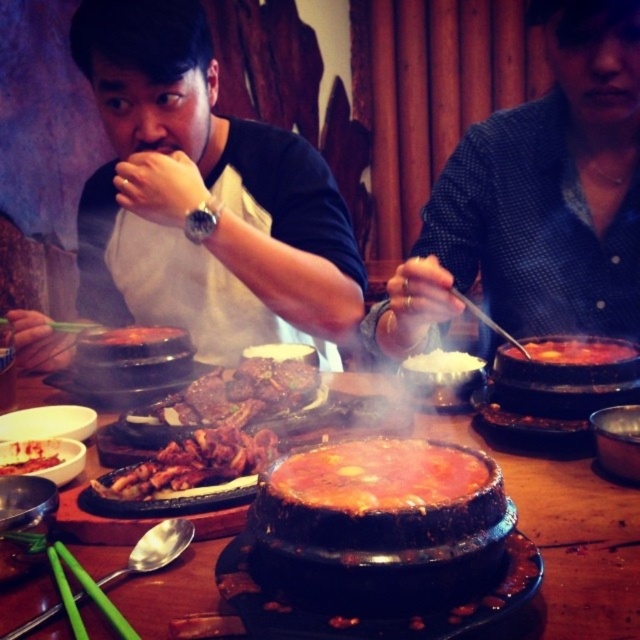
Question: Which of these objects is positioned closest to the brown glossy meat at center?

Choices:
 (A) blue checkered shirt at upper right
 (B) black stone pot at center

Answer: (B)

Question: Considering the relative positions of smokey red clay pot at center and brown matte rice bowl at center in the image provided, where is smokey red clay pot at center located with respect to brown matte rice bowl at center?

Choices:
 (A) above
 (B) below

Answer: (A)

Question: Can you confirm if black stone pot at center is bigger than green plastic chopsticks at lower left?

Choices:
 (A) yes
 (B) no

Answer: (A)

Question: Is black stone pot at center closer to the viewer compared to white fluffy rice at center?

Choices:
 (A) yes
 (B) no

Answer: (A)

Question: Estimate the real-world distances between objects in this image. Which object is farther from the blue checkered shirt at upper right?

Choices:
 (A) green plastic chopsticks at lower left
 (B) white fluffy rice at center

Answer: (A)

Question: Estimate the real-world distances between objects in this image. Which object is farther from the grilled meat at center?

Choices:
 (A) white fluffy rice at center
 (B) brown matte rice bowl at center

Answer: (A)